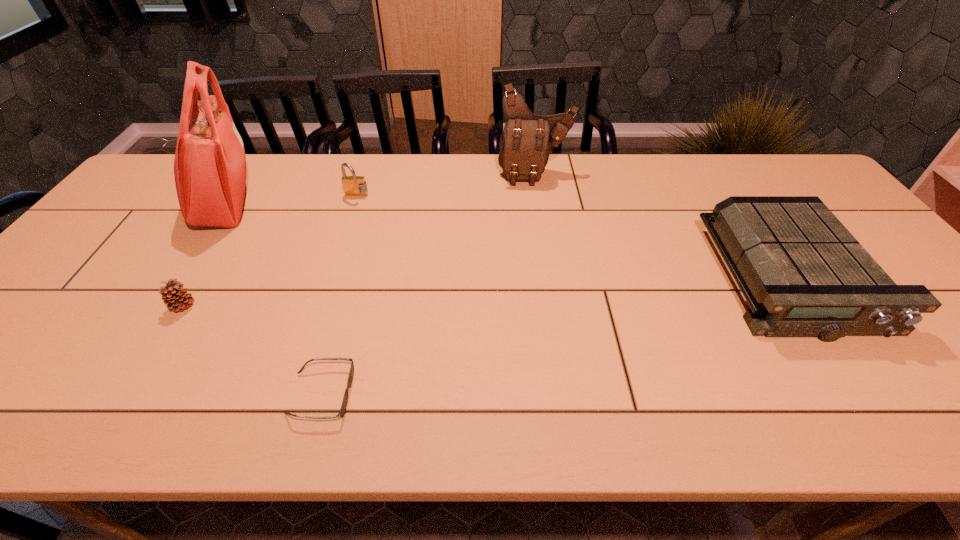
This screenshot has height=540, width=960. In order to click on vacant space that is in between the shortest object and the rightmost object in this screenshot , I will do `click(556, 336)`.

Image resolution: width=960 pixels, height=540 pixels. I want to click on free point between the padlock and the shoulder bag, so click(x=445, y=185).

I want to click on free space between the fifth tallest object and the padlock, so click(x=270, y=251).

The width and height of the screenshot is (960, 540). I want to click on object that is the third closest to the handbag, so click(x=342, y=411).

Where is `object that is the closest to the padlock`? object that is the closest to the padlock is located at coordinates (210, 170).

Find the location of a particular element. This screenshot has width=960, height=540. free region that satisfies the following two spatial constraints: 1. on the front-facing side of the tallest object; 2. on the back side of the fifth tallest object is located at coordinates (157, 306).

The image size is (960, 540). Find the location of `free space that satisfies the following two spatial constraints: 1. on the side with the combination dials of the padlock; 2. on the front-facing side of the handbag`. free space that satisfies the following two spatial constraints: 1. on the side with the combination dials of the padlock; 2. on the front-facing side of the handbag is located at coordinates (354, 204).

This screenshot has width=960, height=540. In order to click on free point that satisfies the following two spatial constraints: 1. on the side with the combination dials of the padlock; 2. on the front-facing side of the handbag in this screenshot , I will do `click(354, 204)`.

Identify the location of vacant space that satisfies the following two spatial constraints: 1. on the front-facing side of the handbag; 2. on the right side of the second shortest object. (157, 306).

In order to click on free space that satisfies the following two spatial constraints: 1. on the front-facing side of the second tallest object; 2. on the front-facing side of the tallest object in this screenshot , I will do `click(540, 204)`.